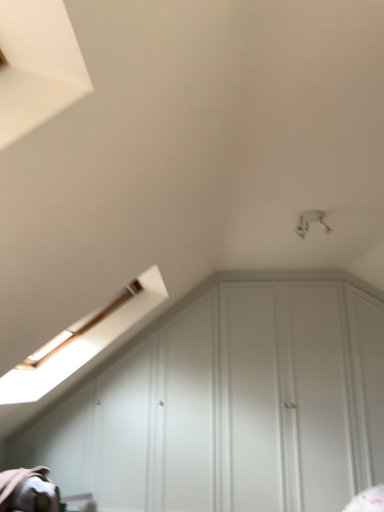
Question: Does white matte cabinet at lower center have a greater height compared to white glossy light fixture at upper right?

Choices:
 (A) yes
 (B) no

Answer: (A)

Question: Considering the relative sizes of white matte cabinet at lower center and white glossy light fixture at upper right in the image provided, is white matte cabinet at lower center thinner than white glossy light fixture at upper right?

Choices:
 (A) yes
 (B) no

Answer: (A)

Question: Is white glossy light fixture at upper right completely or partially inside white matte cabinet at lower center?

Choices:
 (A) no
 (B) yes

Answer: (A)

Question: Considering the relative sizes of white matte cabinet at lower center and white glossy light fixture at upper right in the image provided, is white matte cabinet at lower center shorter than white glossy light fixture at upper right?

Choices:
 (A) yes
 (B) no

Answer: (B)

Question: Is white matte cabinet at lower center oriented away from white glossy light fixture at upper right?

Choices:
 (A) yes
 (B) no

Answer: (B)

Question: Considering the relative sizes of white matte cabinet at lower center and white glossy light fixture at upper right in the image provided, is white matte cabinet at lower center smaller than white glossy light fixture at upper right?

Choices:
 (A) yes
 (B) no

Answer: (B)

Question: Is white glossy light fixture at upper right at the left side of white matte cabinet at lower center?

Choices:
 (A) yes
 (B) no

Answer: (B)

Question: Does white glossy light fixture at upper right have a larger size compared to white matte cabinet at lower center?

Choices:
 (A) yes
 (B) no

Answer: (B)

Question: Could you tell me if white glossy light fixture at upper right is facing white matte cabinet at lower center?

Choices:
 (A) yes
 (B) no

Answer: (B)

Question: From the image's perspective, is white glossy light fixture at upper right located beneath white matte cabinet at lower center?

Choices:
 (A) yes
 (B) no

Answer: (B)

Question: From a real-world perspective, is white glossy light fixture at upper right on top of white matte cabinet at lower center?

Choices:
 (A) no
 (B) yes

Answer: (B)

Question: Considering the relative positions of white glossy light fixture at upper right and white matte cabinet at lower center in the image provided, is white glossy light fixture at upper right behind white matte cabinet at lower center?

Choices:
 (A) yes
 (B) no

Answer: (B)

Question: Which is correct: white glossy light fixture at upper right is inside white matte cabinet at lower center, or outside of it?

Choices:
 (A) inside
 (B) outside

Answer: (B)